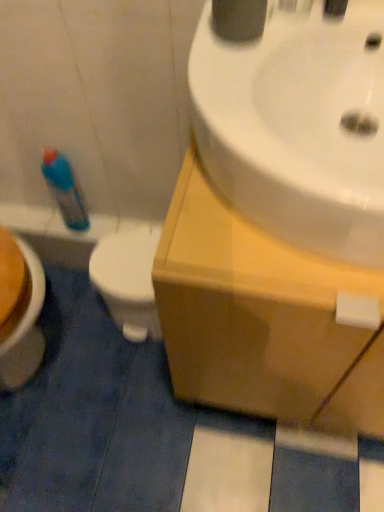
Question: Is wooden cabinet at upper right at the left side of white glossy sink at upper right?

Choices:
 (A) yes
 (B) no

Answer: (B)

Question: Does wooden cabinet at upper right have a greater width compared to white glossy sink at upper right?

Choices:
 (A) yes
 (B) no

Answer: (A)

Question: Is wooden cabinet at upper right placed right next to white glossy sink at upper right?

Choices:
 (A) yes
 (B) no

Answer: (B)

Question: From the image's perspective, does wooden cabinet at upper right appear higher than white glossy sink at upper right?

Choices:
 (A) no
 (B) yes

Answer: (A)

Question: Can you confirm if wooden cabinet at upper right is positioned to the right of white glossy sink at upper right?

Choices:
 (A) no
 (B) yes

Answer: (B)

Question: Is wooden cabinet at upper right bigger or smaller than white glossy sink at upper right?

Choices:
 (A) small
 (B) big

Answer: (B)

Question: From a real-world perspective, is wooden cabinet at upper right physically located above or below white glossy sink at upper right?

Choices:
 (A) below
 (B) above

Answer: (A)

Question: From the image's perspective, is wooden cabinet at upper right located above or below white glossy sink at upper right?

Choices:
 (A) below
 (B) above

Answer: (A)

Question: Visually, is wooden cabinet at upper right positioned to the left or to the right of white glossy sink at upper right?

Choices:
 (A) right
 (B) left

Answer: (A)

Question: Is white glossy sink at upper right in front of or behind blue plastic bottle at left in the image?

Choices:
 (A) front
 (B) behind

Answer: (A)

Question: Is white glossy sink at upper right taller or shorter than blue plastic bottle at left?

Choices:
 (A) short
 (B) tall

Answer: (B)

Question: Considering the positions of point (306, 56) and point (91, 226), is point (306, 56) closer or farther from the camera than point (91, 226)?

Choices:
 (A) closer
 (B) farther

Answer: (A)

Question: In terms of width, does white glossy sink at upper right look wider or thinner when compared to blue plastic bottle at left?

Choices:
 (A) thin
 (B) wide

Answer: (B)

Question: In terms of height, does white glossy sink at upper right look taller or shorter compared to wooden cabinet at upper right?

Choices:
 (A) short
 (B) tall

Answer: (A)

Question: Does point (231, 129) appear closer or farther from the camera than point (254, 248)?

Choices:
 (A) closer
 (B) farther

Answer: (A)